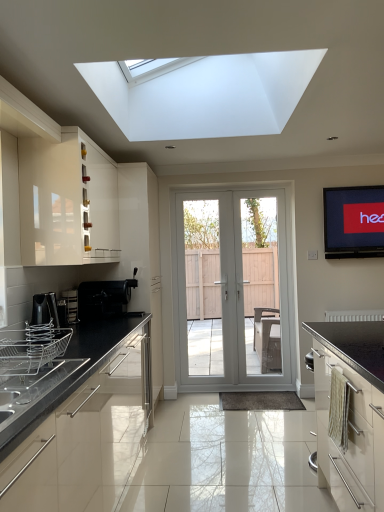
Question: Is black matte coffee machine at left, placed as the 4th appliance when sorted from front to back, to the right of satin silver toaster at left, the 3th appliance from the front, from the viewer's perspective?

Choices:
 (A) no
 (B) yes

Answer: (B)

Question: From a real-world perspective, is black matte coffee machine at left, placed as the 4th appliance when sorted from front to back, on top of satin silver toaster at left, placed as the second appliance when sorted from back to front?

Choices:
 (A) yes
 (B) no

Answer: (A)

Question: Does black matte coffee machine at left, the first appliance positioned from the back, appear on the left side of satin silver toaster at left, placed as the second appliance when sorted from back to front?

Choices:
 (A) no
 (B) yes

Answer: (A)

Question: Can you confirm if black matte coffee machine at left, placed as the 4th appliance when sorted from front to back, is shorter than satin silver toaster at left, the 3th appliance from the front?

Choices:
 (A) yes
 (B) no

Answer: (B)

Question: Could you tell me if black matte coffee machine at left, placed as the 4th appliance when sorted from front to back, is turned towards satin silver toaster at left, placed as the second appliance when sorted from back to front?

Choices:
 (A) no
 (B) yes

Answer: (A)

Question: Considering the positions of point (72, 309) and point (369, 384), is point (72, 309) closer or farther from the camera than point (369, 384)?

Choices:
 (A) closer
 (B) farther

Answer: (B)

Question: Is satin silver toaster at left, the 3th appliance from the front, in front of or behind matte black oven at lower right, which is the first cabinetry in right-to-left order, in the image?

Choices:
 (A) front
 (B) behind

Answer: (B)

Question: From their relative heights in the image, would you say satin silver toaster at left, placed as the second appliance when sorted from back to front, is taller or shorter than matte black oven at lower right, acting as the second cabinetry starting from the top?

Choices:
 (A) short
 (B) tall

Answer: (A)

Question: Considering the positions of satin silver toaster at left, placed as the second appliance when sorted from back to front, and matte black oven at lower right, acting as the 1th cabinetry starting from the bottom, in the image, is satin silver toaster at left, placed as the second appliance when sorted from back to front, bigger or smaller than matte black oven at lower right, acting as the 1th cabinetry starting from the bottom,?

Choices:
 (A) small
 (B) big

Answer: (A)

Question: Is black matte coffee machine at left, placed as the 4th appliance when sorted from front to back, inside or outside of metallic silver dish rack at left, which is the 2th appliance in front-to-back order?

Choices:
 (A) inside
 (B) outside

Answer: (B)

Question: Is black matte coffee machine at left, the first appliance positioned from the back, in front of or behind metallic silver dish rack at left, the 3th appliance viewed from the back, in the image?

Choices:
 (A) behind
 (B) front

Answer: (A)

Question: Based on their sizes in the image, would you say black matte coffee machine at left, the first appliance positioned from the back, is bigger or smaller than metallic silver dish rack at left, which is the 2th appliance in front-to-back order?

Choices:
 (A) big
 (B) small

Answer: (A)

Question: Is point click(124, 282) closer or farther from the camera than point click(39, 302)?

Choices:
 (A) closer
 (B) farther

Answer: (B)

Question: Is metallic silver dish rack at left, the 3th appliance viewed from the back, wider or thinner than black matte coffee machine at left, placed as the 4th appliance when sorted from front to back?

Choices:
 (A) thin
 (B) wide

Answer: (A)

Question: Is metallic silver dish rack at left, which is the 2th appliance in front-to-back order, bigger or smaller than black matte coffee machine at left, placed as the 4th appliance when sorted from front to back?

Choices:
 (A) small
 (B) big

Answer: (A)